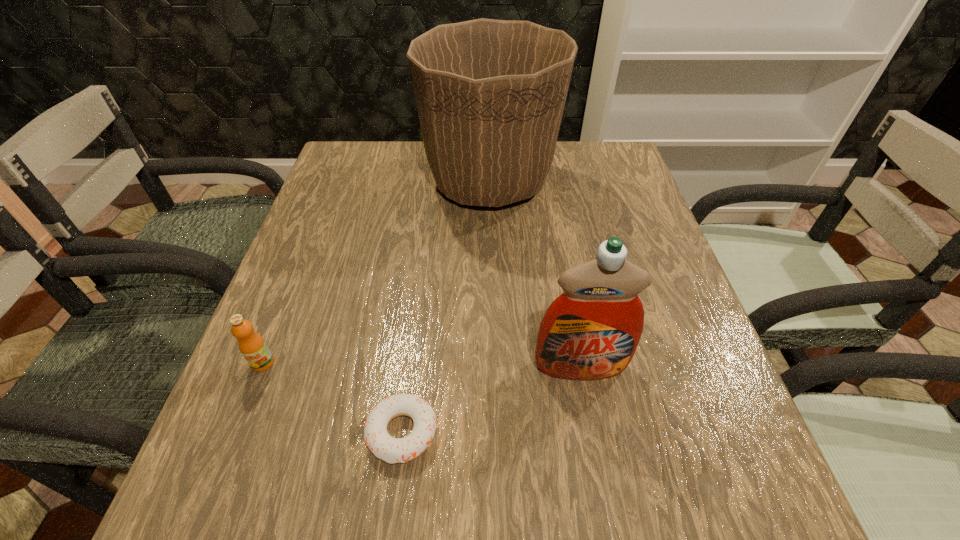
Locate an element on the screen. the tallest object is located at coordinates (490, 93).

I want to click on the farthest object, so click(490, 93).

Identify the location of detergent. (591, 331).

The width and height of the screenshot is (960, 540). I want to click on orange juice, so click(x=251, y=344).

In order to click on the second shortest object in this screenshot , I will do coord(251,344).

Identify the location of the nearest object. The height and width of the screenshot is (540, 960). (392, 450).

You are a GUI agent. You are given a task and a screenshot of the screen. Output one action in this format:
    pyautogui.click(x=<x>, y=<y>)
    Task: Click on the doughnut
    This screenshot has height=540, width=960.
    Given the screenshot: What is the action you would take?
    pyautogui.click(x=392, y=450)

Find the location of a particular element. free space located on the right of the flowerpot is located at coordinates (588, 181).

Where is `vacant area located 0.220m on the front surface of the second tallest object`? Image resolution: width=960 pixels, height=540 pixels. vacant area located 0.220m on the front surface of the second tallest object is located at coordinates (611, 530).

Find the location of a particular element. The width and height of the screenshot is (960, 540). vacant space located 0.050m on the front label of the orange juice is located at coordinates (249, 399).